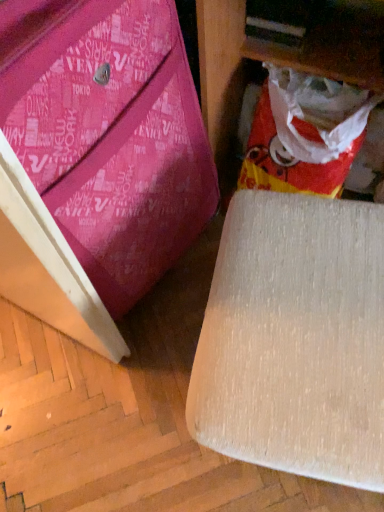
Question: Is beige fabric chair at lower right, the first furniture from the right, bigger than pink fabric bag at lower left, acting as the 2th furniture starting from the right?

Choices:
 (A) no
 (B) yes

Answer: (A)

Question: Is beige fabric chair at lower right, the first furniture from the right, wider than pink fabric bag at lower left, acting as the 2th furniture starting from the right?

Choices:
 (A) no
 (B) yes

Answer: (B)

Question: Can you confirm if beige fabric chair at lower right, which is the 2th furniture in left-to-right order, is taller than pink fabric bag at lower left, which ranks as the 1th furniture in left-to-right order?

Choices:
 (A) yes
 (B) no

Answer: (B)

Question: From the image's perspective, is beige fabric chair at lower right, the first furniture from the right, under pink fabric bag at lower left, which ranks as the 1th furniture in left-to-right order?

Choices:
 (A) no
 (B) yes

Answer: (B)

Question: Are beige fabric chair at lower right, which is the 2th furniture in left-to-right order, and pink fabric bag at lower left, which ranks as the 1th furniture in left-to-right order, making contact?

Choices:
 (A) yes
 (B) no

Answer: (B)

Question: Is beige fabric chair at lower right, the first furniture from the right, bigger or smaller than red/yellow plastic bag at lower right?

Choices:
 (A) big
 (B) small

Answer: (A)

Question: From the image's perspective, is beige fabric chair at lower right, the first furniture from the right, located above or below red/yellow plastic bag at lower right?

Choices:
 (A) above
 (B) below

Answer: (B)

Question: Visually, is beige fabric chair at lower right, which is the 2th furniture in left-to-right order, positioned to the left or to the right of red/yellow plastic bag at lower right?

Choices:
 (A) right
 (B) left

Answer: (B)

Question: In terms of height, does beige fabric chair at lower right, the first furniture from the right, look taller or shorter compared to red/yellow plastic bag at lower right?

Choices:
 (A) tall
 (B) short

Answer: (A)

Question: Based on their sizes in the image, would you say red/yellow plastic bag at lower right is bigger or smaller than pink fabric bag at lower left, which ranks as the 1th furniture in left-to-right order?

Choices:
 (A) big
 (B) small

Answer: (B)

Question: Would you say red/yellow plastic bag at lower right is to the left or to the right of pink fabric bag at lower left, which ranks as the 1th furniture in left-to-right order, in the picture?

Choices:
 (A) left
 (B) right

Answer: (B)

Question: Considering the positions of red/yellow plastic bag at lower right and pink fabric bag at lower left, acting as the 2th furniture starting from the right, in the image, is red/yellow plastic bag at lower right wider or thinner than pink fabric bag at lower left, acting as the 2th furniture starting from the right,?

Choices:
 (A) thin
 (B) wide

Answer: (A)

Question: Choose the correct answer: Is red/yellow plastic bag at lower right inside pink fabric bag at lower left, acting as the 2th furniture starting from the right, or outside it?

Choices:
 (A) outside
 (B) inside

Answer: (A)

Question: Would you say pink fabric bag at lower left, which ranks as the 1th furniture in left-to-right order, is to the left or to the right of red/yellow plastic bag at lower right in the picture?

Choices:
 (A) right
 (B) left

Answer: (B)

Question: From a real-world perspective, is pink fabric bag at lower left, acting as the 2th furniture starting from the right, positioned above or below red/yellow plastic bag at lower right?

Choices:
 (A) below
 (B) above

Answer: (B)